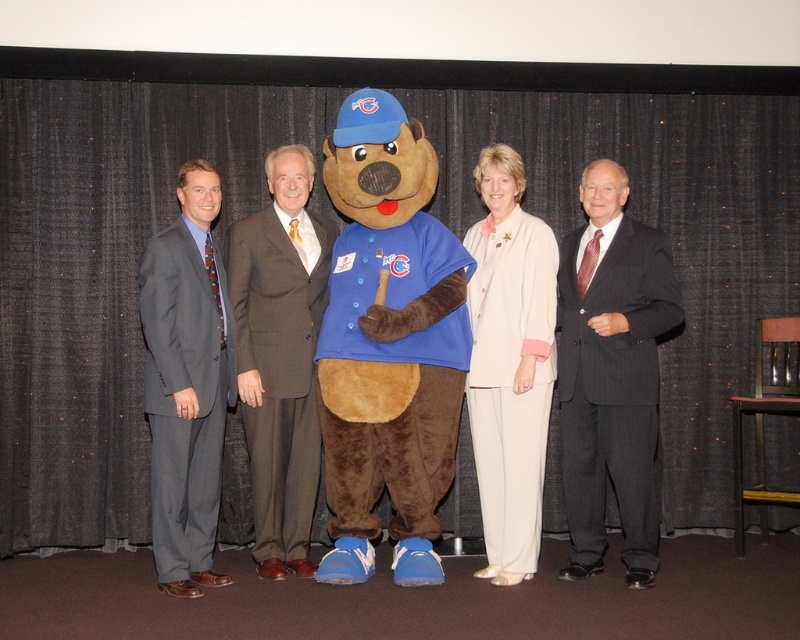
Question: Among these objects, which one is nearest to the camera?

Choices:
 (A) gray suit at left
 (B) dark gray pinstripe suit at right
 (C) brown plush teddy bear at center
 (D) light beige fabric suit at center

Answer: (A)

Question: Can you confirm if brown wool suit at center is bigger than gray suit at left?

Choices:
 (A) no
 (B) yes

Answer: (B)

Question: Which point is closer to the camera?

Choices:
 (A) brown plush teddy bear at center
 (B) light beige fabric suit at center

Answer: (A)

Question: Can you confirm if dark gray pinstripe suit at right is smaller than light beige fabric suit at center?

Choices:
 (A) yes
 (B) no

Answer: (B)

Question: Which point is farther from the camera taking this photo?

Choices:
 (A) (145, 298)
 (B) (252, 390)
 (C) (529, 570)
 (D) (437, 468)

Answer: (B)

Question: Observing the image, what is the correct spatial positioning of brown plush teddy bear at center in reference to gray suit at left?

Choices:
 (A) above
 (B) below

Answer: (A)